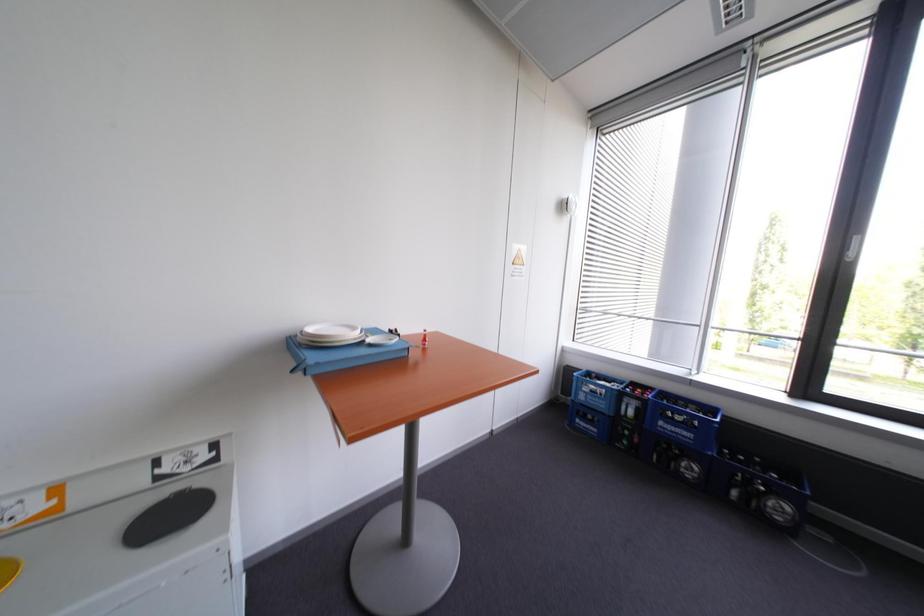
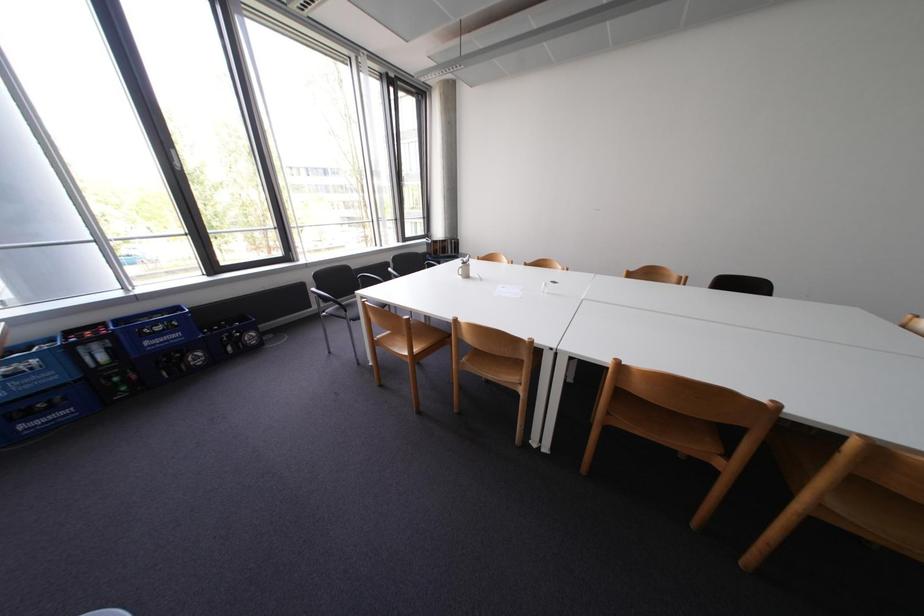
Based on the continuous images, in which direction is the camera rotating?

The camera's rotation is toward right-down.